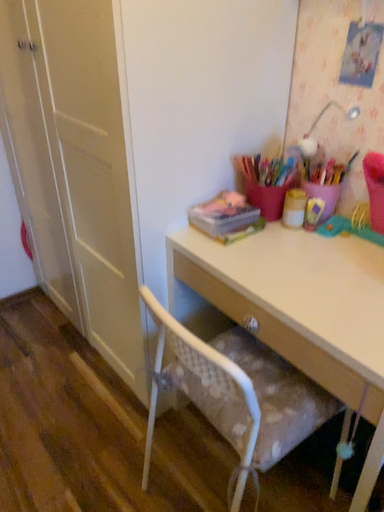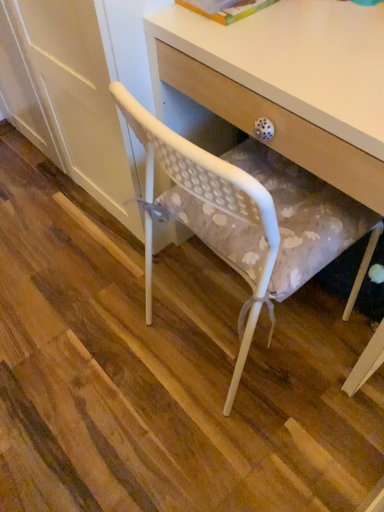
Question: How did the camera likely rotate when shooting the video?

Choices:
 (A) rotated upward
 (B) rotated downward

Answer: (B)